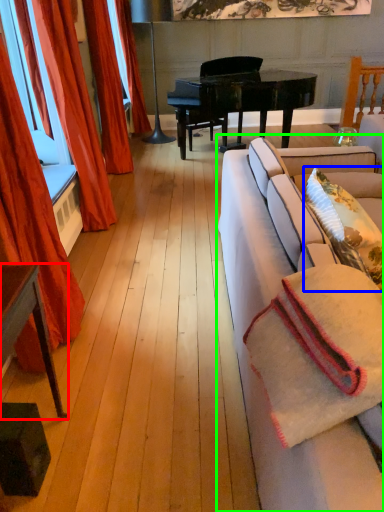
Question: Considering the real-world distances, which object is farthest from table (highlighted by a red box)? pillow (highlighted by a blue box) or studio couch (highlighted by a green box)?

Choices:
 (A) pillow
 (B) studio couch

Answer: (A)